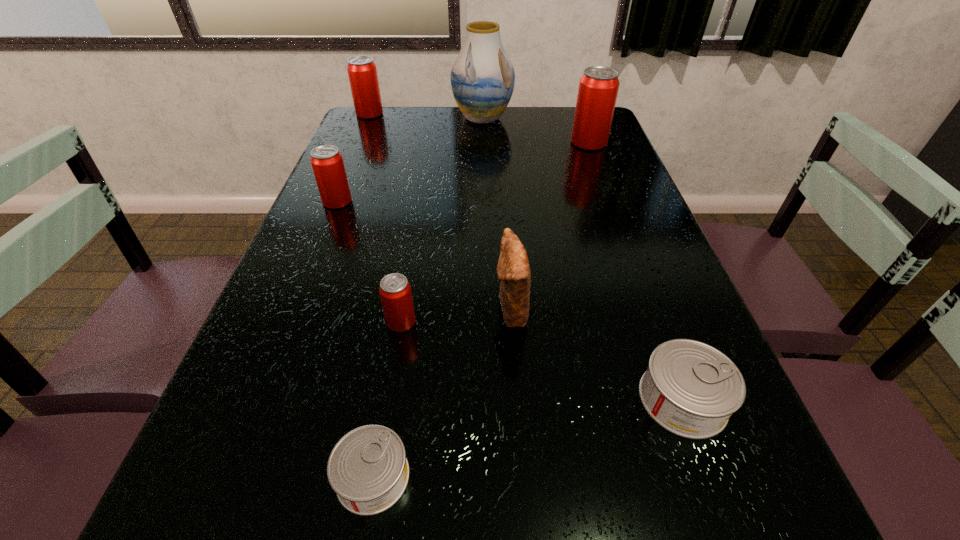
Find the location of `free space located on the back of the fourth nearest can`. free space located on the back of the fourth nearest can is located at coordinates (364, 137).

Identify the location of free space located 0.290m on the front of the third nearest can. (372, 492).

Locate an element on the screen. free spot located on the front of the bigger silver can is located at coordinates (712, 480).

Find the location of a particular element. Image resolution: width=960 pixels, height=540 pixels. vacant position located on the right of the nearer silver can is located at coordinates (450, 477).

I want to click on vase present at the far edge, so click(x=482, y=78).

Where is `object that is at the far left corner`? The image size is (960, 540). object that is at the far left corner is located at coordinates (362, 72).

The image size is (960, 540). What are the coordinates of `object that is positioned at the far right corner` in the screenshot? It's located at (598, 87).

Locate an element on the screen. The image size is (960, 540). free space at the far edge is located at coordinates (553, 119).

Locate an element on the screen. This screenshot has width=960, height=540. free location at the left edge of the desktop is located at coordinates (252, 489).

The height and width of the screenshot is (540, 960). Identify the location of free space at the right edge of the desktop. (720, 444).